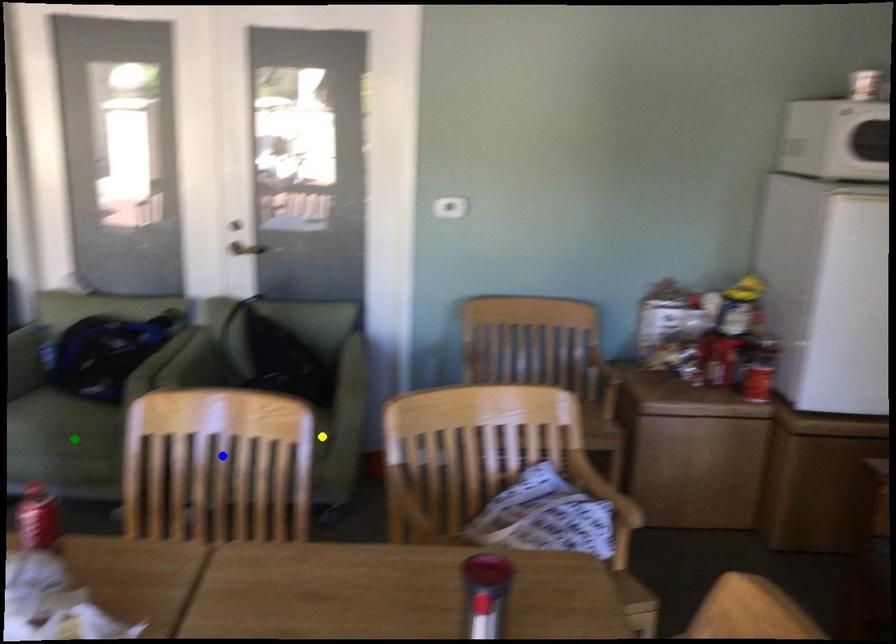
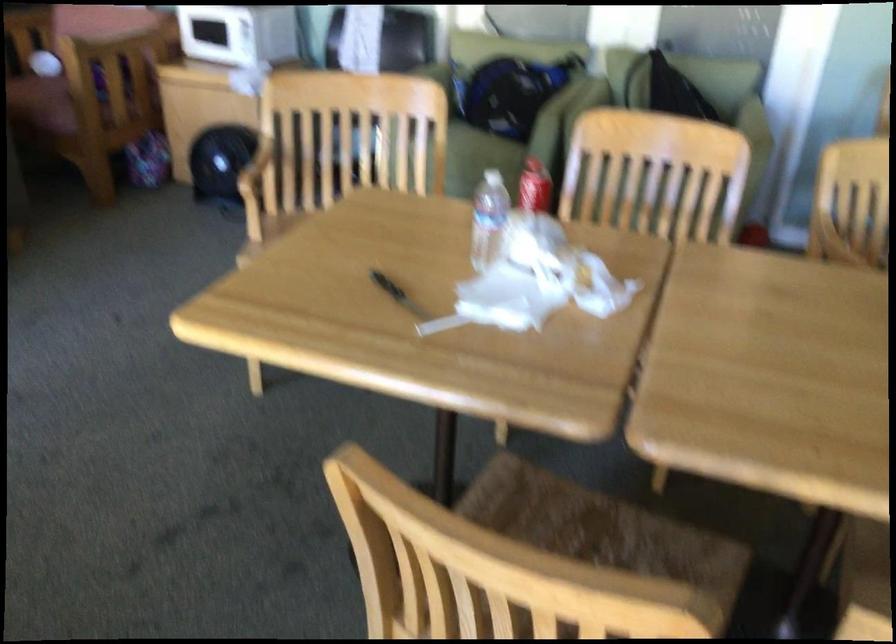
I am providing you with two images of the same scene from different viewpoints. Three points are marked in image1. Which point corresponds to a part or object that is occluded in image2?In image1, three points are marked. Which of them correspond to a part or object that is occluded in image2?Among the three points shown in image1, which one corresponds to a part or object that is no longer visible due to occlusion in image2?

Invisible in image2: yellow point.